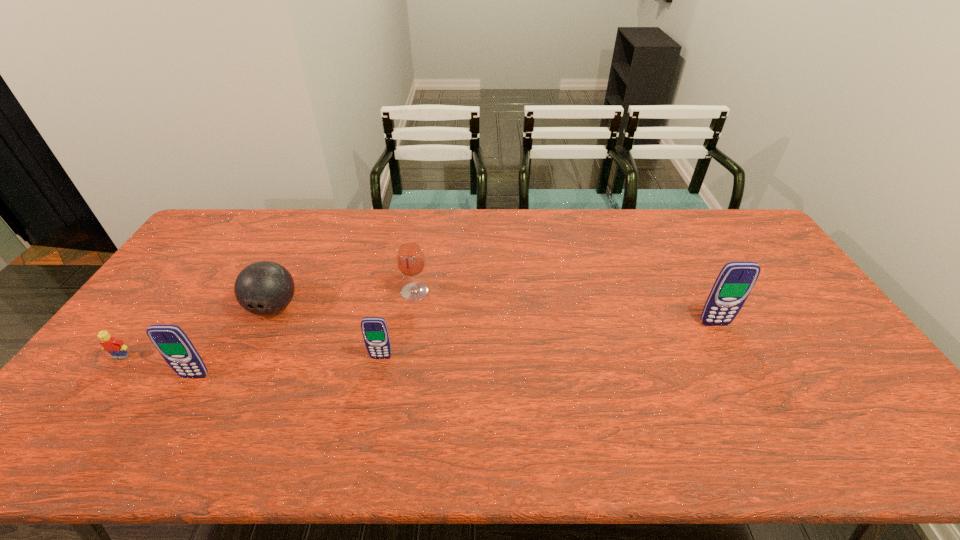
The width and height of the screenshot is (960, 540). Find the location of `blank area located 0.060m on the front-facing side of the second cellular telephone from left to right`. blank area located 0.060m on the front-facing side of the second cellular telephone from left to right is located at coordinates (376, 379).

Where is `free location located on the front-facing side of the farthest cellular telephone`? free location located on the front-facing side of the farthest cellular telephone is located at coordinates (744, 380).

This screenshot has height=540, width=960. What are the coordinates of `vacant point located 0.300m on the back of the wineglass` in the screenshot? It's located at (425, 227).

Where is `vacant region located on the front-facing side of the shortest object`? This screenshot has height=540, width=960. vacant region located on the front-facing side of the shortest object is located at coordinates (92, 396).

Where is `vacant space situated 0.070m on the grip area of the bowling ball`? vacant space situated 0.070m on the grip area of the bowling ball is located at coordinates (254, 346).

This screenshot has height=540, width=960. What are the coordinates of `object that is positioned at the left edge` in the screenshot? It's located at (117, 349).

Find the location of a particular element. The width and height of the screenshot is (960, 540). vacant space at the far edge of the desktop is located at coordinates (685, 238).

Where is `vacant space at the near edge of the desktop`? vacant space at the near edge of the desktop is located at coordinates (152, 403).

The height and width of the screenshot is (540, 960). I want to click on free region at the left edge, so click(198, 267).

You are a GUI agent. You are given a task and a screenshot of the screen. Output one action in this format:
    pyautogui.click(x=<x>, y=<y>)
    Task: Click on the free space at the right edge of the desktop
    This screenshot has height=540, width=960.
    Given the screenshot: What is the action you would take?
    pyautogui.click(x=804, y=326)